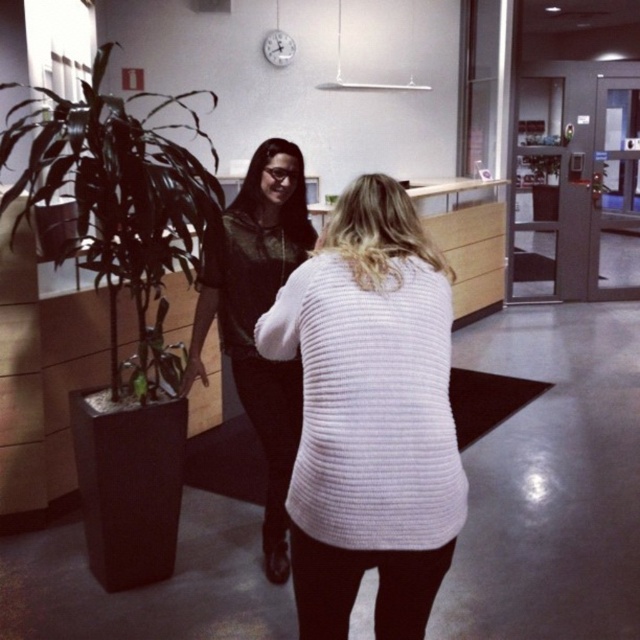
Is white ribbed sweater at center positioned before green leafy plant at center?

Yes.

Is point (433, 541) positioned before point (324, 196)?

That is True.

This screenshot has width=640, height=640. I want to click on white ribbed sweater at center, so click(369, 416).

Can you confirm if green leafy plant at left is bigger than white textured sweater at center?

Indeed, green leafy plant at left has a larger size compared to white textured sweater at center.

Is green leafy plant at left smaller than white textured sweater at center?

Incorrect, green leafy plant at left is not smaller in size than white textured sweater at center.

You are a GUI agent. You are given a task and a screenshot of the screen. Output one action in this format:
    pyautogui.click(x=<x>, y=<y>)
    Task: Click on the green leafy plant at left
    This screenshot has width=640, height=640.
    Given the screenshot: What is the action you would take?
    pyautogui.click(x=120, y=204)

How far apart are green leafy plant at left and green leafy plant at center?

green leafy plant at left is 3.11 meters away from green leafy plant at center.

From the picture: Can you confirm if green leafy plant at left is thinner than green leafy plant at center?

Incorrect, green leafy plant at left's width is not less than green leafy plant at center's.

Find the location of a particular element. This screenshot has height=640, width=640. green leafy plant at left is located at coordinates (120, 204).